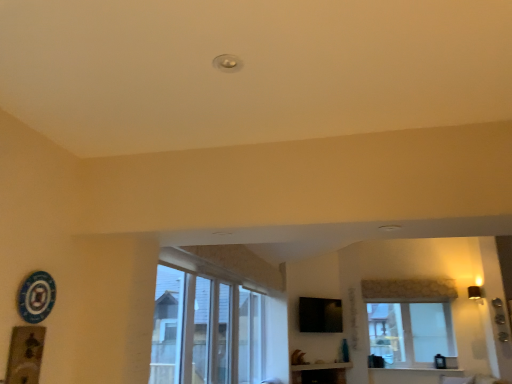
Question: Is white textured wood at lower center smaller than black glossy tv at upper center?

Choices:
 (A) yes
 (B) no

Answer: (A)

Question: Considering the relative sizes of white textured wood at lower center and black glossy tv at upper center in the image provided, is white textured wood at lower center wider than black glossy tv at upper center?

Choices:
 (A) no
 (B) yes

Answer: (B)

Question: Can you confirm if white textured wood at lower center is shorter than black glossy tv at upper center?

Choices:
 (A) no
 (B) yes

Answer: (B)

Question: Is white textured wood at lower center directly adjacent to black glossy tv at upper center?

Choices:
 (A) yes
 (B) no

Answer: (B)

Question: From the image's perspective, is white textured wood at lower center under black glossy tv at upper center?

Choices:
 (A) no
 (B) yes

Answer: (B)

Question: From the image's perspective, is white textured wood at lower center over black glossy tv at upper center?

Choices:
 (A) yes
 (B) no

Answer: (B)

Question: Can white textured wood at lower center be found inside white glass window at center?

Choices:
 (A) no
 (B) yes

Answer: (A)

Question: Does white glass window at center have a lesser height compared to white textured wood at lower center?

Choices:
 (A) yes
 (B) no

Answer: (B)

Question: From the image's perspective, would you say white glass window at center is positioned over white textured wood at lower center?

Choices:
 (A) no
 (B) yes

Answer: (B)

Question: Would you say white glass window at center is outside white textured wood at lower center?

Choices:
 (A) no
 (B) yes

Answer: (B)

Question: From a real-world perspective, is white glass window at center positioned over white textured wood at lower center based on gravity?

Choices:
 (A) no
 (B) yes

Answer: (B)

Question: Does white glass window at center come behind white textured wood at lower center?

Choices:
 (A) yes
 (B) no

Answer: (A)

Question: Is white textured wood at lower center shorter than white glass window at center?

Choices:
 (A) no
 (B) yes

Answer: (B)